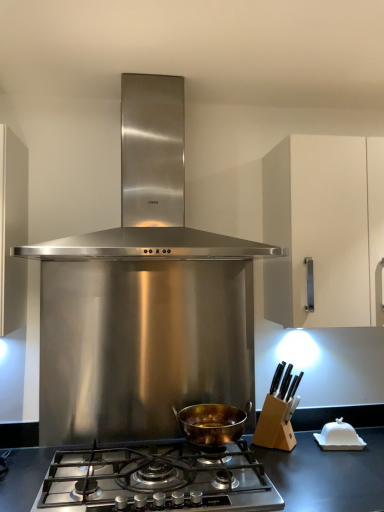
This screenshot has width=384, height=512. I want to click on free spot above stainless steel range hood at center, which ranks as the first kitchen appliance in top-to-bottom order (from a real-world perspective), so click(x=160, y=66).